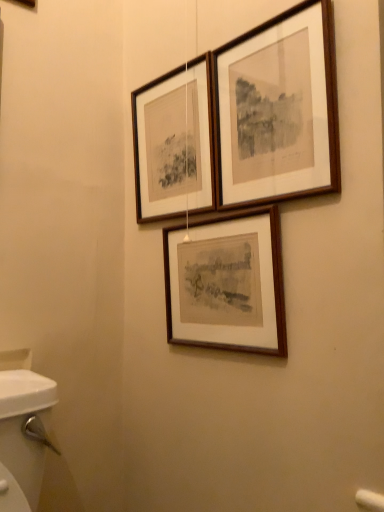
Where is `wooden picture frame at upper center, which is the 3th picture frame in bottom-to-top order`? The image size is (384, 512). wooden picture frame at upper center, which is the 3th picture frame in bottom-to-top order is located at coordinates click(278, 109).

What is the approximate height of wooden picture frame at upper center, which is the 3th picture frame in bottom-to-top order?

It is 15.46 inches.

How much space does wooden frame at upper center, which ranks as the second picture frame in top-to-bottom order, occupy horizontally?

wooden frame at upper center, which ranks as the second picture frame in top-to-bottom order, is 1.67 inches in width.

Where is `wooden frame at center, which is the third picture frame in top-to-bottom order`? This screenshot has width=384, height=512. wooden frame at center, which is the third picture frame in top-to-bottom order is located at coordinates (229, 283).

Which of these two, wooden frame at center, which is the third picture frame in top-to-bottom order, or wooden frame at upper center, which ranks as the second picture frame in top-to-bottom order, is wider?

With larger width is wooden frame at center, which is the third picture frame in top-to-bottom order.

How different are the orientations of wooden frame at center, which is the third picture frame in top-to-bottom order, and wooden frame at upper center, the 2th picture frame ordered from the bottom, in degrees?

The angle between the facing direction of wooden frame at center, which is the third picture frame in top-to-bottom order, and the facing direction of wooden frame at upper center, the 2th picture frame ordered from the bottom, is 2.11 degrees.

Is wooden frame at center, which is the third picture frame in top-to-bottom order, further to camera compared to wooden frame at upper center, which ranks as the second picture frame in top-to-bottom order?

That is False.

Considering the relative positions of wooden frame at center, which is the third picture frame in top-to-bottom order, and wooden frame at upper center, which ranks as the second picture frame in top-to-bottom order, in the image provided, is wooden frame at center, which is the third picture frame in top-to-bottom order, to the left or to the right of wooden frame at upper center, which ranks as the second picture frame in top-to-bottom order,?

Clearly, wooden frame at center, which is the third picture frame in top-to-bottom order, is on the right of wooden frame at upper center, which ranks as the second picture frame in top-to-bottom order, in the image.

How many degrees apart are the facing directions of wooden picture frame at upper center, the 1th picture frame when ordered from top to bottom, and wooden frame at center, positioned as the first picture frame in bottom-to-top order?

wooden picture frame at upper center, the 1th picture frame when ordered from top to bottom, and wooden frame at center, positioned as the first picture frame in bottom-to-top order, are facing 0.41 degrees away from each other.

Consider the image. Could you tell me if wooden picture frame at upper center, which is the 3th picture frame in bottom-to-top order, is turned towards wooden frame at center, which is the third picture frame in top-to-bottom order?

No.

Is wooden picture frame at upper center, the 1th picture frame when ordered from top to bottom, taller or shorter than wooden frame at center, positioned as the first picture frame in bottom-to-top order?

Considering their sizes, wooden picture frame at upper center, the 1th picture frame when ordered from top to bottom, has more height than wooden frame at center, positioned as the first picture frame in bottom-to-top order.

From the image's perspective, is wooden picture frame at upper center, the 1th picture frame when ordered from top to bottom, positioned above or below wooden frame at center, which is the third picture frame in top-to-bottom order?

From the image's perspective, wooden picture frame at upper center, the 1th picture frame when ordered from top to bottom, appears above wooden frame at center, which is the third picture frame in top-to-bottom order.

Does wooden picture frame at upper center, which is the 3th picture frame in bottom-to-top order, have a lesser height compared to wooden frame at upper center, the 2th picture frame ordered from the bottom?

Indeed, wooden picture frame at upper center, which is the 3th picture frame in bottom-to-top order, has a lesser height compared to wooden frame at upper center, the 2th picture frame ordered from the bottom.

Is point (296, 11) farther from camera compared to point (152, 164)?

No, (296, 11) is closer to viewer.

Choose the correct answer: Is wooden picture frame at upper center, the 1th picture frame when ordered from top to bottom, inside wooden frame at upper center, which ranks as the second picture frame in top-to-bottom order, or outside it?

wooden picture frame at upper center, the 1th picture frame when ordered from top to bottom, is not enclosed by wooden frame at upper center, which ranks as the second picture frame in top-to-bottom order.

Is the surface of wooden picture frame at upper center, which is the 3th picture frame in bottom-to-top order, in direct contact with wooden frame at upper center, which ranks as the second picture frame in top-to-bottom order?

No, wooden picture frame at upper center, which is the 3th picture frame in bottom-to-top order, is not in contact with wooden frame at upper center, which ranks as the second picture frame in top-to-bottom order.

Between point (212, 142) and point (194, 285), which one is positioned behind?

The point (194, 285) is farther from the camera.

Could wooden frame at center, which is the third picture frame in top-to-bottom order, be considered to be inside wooden frame at upper center, which ranks as the second picture frame in top-to-bottom order?

No, wooden frame at center, which is the third picture frame in top-to-bottom order, is not a part of wooden frame at upper center, which ranks as the second picture frame in top-to-bottom order.

From a real-world perspective, which object stands above the other?

From a 3D spatial view, wooden frame at upper center, the 2th picture frame ordered from the bottom, is above.

Who is more distant, wooden frame at upper center, the 2th picture frame ordered from the bottom, or wooden frame at center, positioned as the first picture frame in bottom-to-top order?

wooden frame at upper center, the 2th picture frame ordered from the bottom, is further from the camera.

Who is shorter, wooden frame at upper center, the 2th picture frame ordered from the bottom, or wooden picture frame at upper center, the 1th picture frame when ordered from top to bottom?

Standing shorter between the two is wooden picture frame at upper center, the 1th picture frame when ordered from top to bottom.

Between wooden frame at upper center, which ranks as the second picture frame in top-to-bottom order, and wooden picture frame at upper center, the 1th picture frame when ordered from top to bottom, which one appears on the left side from the viewer's perspective?

wooden frame at upper center, which ranks as the second picture frame in top-to-bottom order.

Could you tell me if wooden frame at upper center, which ranks as the second picture frame in top-to-bottom order, is turned towards wooden picture frame at upper center, which is the 3th picture frame in bottom-to-top order?

No, wooden frame at upper center, which ranks as the second picture frame in top-to-bottom order, does not turn towards wooden picture frame at upper center, which is the 3th picture frame in bottom-to-top order.

From the image's perspective, does wooden frame at upper center, the 2th picture frame ordered from the bottom, appear lower than wooden picture frame at upper center, which is the 3th picture frame in bottom-to-top order?

Yes, from the image's perspective, wooden frame at upper center, the 2th picture frame ordered from the bottom, is beneath wooden picture frame at upper center, which is the 3th picture frame in bottom-to-top order.

Does wooden frame at center, which is the third picture frame in top-to-bottom order, have a larger size compared to wooden picture frame at upper center, which is the 3th picture frame in bottom-to-top order?

Indeed, wooden frame at center, which is the third picture frame in top-to-bottom order, has a larger size compared to wooden picture frame at upper center, which is the 3th picture frame in bottom-to-top order.

From a real-world perspective, is wooden frame at center, positioned as the first picture frame in bottom-to-top order, below wooden picture frame at upper center, which is the 3th picture frame in bottom-to-top order?

Indeed, from a real-world perspective, wooden frame at center, positioned as the first picture frame in bottom-to-top order, is positioned beneath wooden picture frame at upper center, which is the 3th picture frame in bottom-to-top order.

Which object is closer to the camera taking this photo, wooden frame at center, positioned as the first picture frame in bottom-to-top order, or wooden picture frame at upper center, which is the 3th picture frame in bottom-to-top order?

wooden picture frame at upper center, which is the 3th picture frame in bottom-to-top order, is more forward.

How different are the orientations of wooden frame at center, which is the third picture frame in top-to-bottom order, and wooden picture frame at upper center, the 1th picture frame when ordered from top to bottom, in degrees?

The angular difference between wooden frame at center, which is the third picture frame in top-to-bottom order, and wooden picture frame at upper center, the 1th picture frame when ordered from top to bottom, is 0.41 degrees.

From the image's perspective, starting from the wooden frame at center, positioned as the first picture frame in bottom-to-top order, which picture frame is the 1st one above? Please provide its 2D coordinates.

[(174, 143)]

Find the location of `picture frame that is in front of the wooden frame at center, positioned as the first picture frame in bottom-to-top order`. picture frame that is in front of the wooden frame at center, positioned as the first picture frame in bottom-to-top order is located at coordinates (278, 109).

Looking at the image, which one is located closer to wooden frame at upper center, which ranks as the second picture frame in top-to-bottom order, wooden frame at center, positioned as the first picture frame in bottom-to-top order, or wooden picture frame at upper center, which is the 3th picture frame in bottom-to-top order?

wooden picture frame at upper center, which is the 3th picture frame in bottom-to-top order, is positioned closer to the anchor wooden frame at upper center, which ranks as the second picture frame in top-to-bottom order.

Considering their positions, is wooden frame at center, positioned as the first picture frame in bottom-to-top order, positioned further to wooden picture frame at upper center, the 1th picture frame when ordered from top to bottom, than wooden frame at upper center, the 2th picture frame ordered from the bottom?

Based on the image, wooden frame at center, positioned as the first picture frame in bottom-to-top order, appears to be further to wooden picture frame at upper center, the 1th picture frame when ordered from top to bottom.

Estimate the real-world distances between objects in this image. Which object is closer to wooden frame at upper center, which ranks as the second picture frame in top-to-bottom order, wooden picture frame at upper center, which is the 3th picture frame in bottom-to-top order, or wooden frame at center, positioned as the first picture frame in bottom-to-top order?

Based on the image, wooden picture frame at upper center, which is the 3th picture frame in bottom-to-top order, appears to be nearer to wooden frame at upper center, which ranks as the second picture frame in top-to-bottom order.

When comparing their distances from wooden picture frame at upper center, the 1th picture frame when ordered from top to bottom, does wooden frame at upper center, which ranks as the second picture frame in top-to-bottom order, or wooden frame at center, which is the third picture frame in top-to-bottom order, seem further?

Based on the image, wooden frame at center, which is the third picture frame in top-to-bottom order, appears to be further to wooden picture frame at upper center, the 1th picture frame when ordered from top to bottom.

Based on their spatial positions, is wooden frame at upper center, which ranks as the second picture frame in top-to-bottom order, or wooden picture frame at upper center, the 1th picture frame when ordered from top to bottom, further from wooden frame at center, which is the third picture frame in top-to-bottom order?

Among the two, wooden frame at upper center, which ranks as the second picture frame in top-to-bottom order, is located further to wooden frame at center, which is the third picture frame in top-to-bottom order.

From the image, which object appears to be farther from wooden frame at center, positioned as the first picture frame in bottom-to-top order, wooden picture frame at upper center, the 1th picture frame when ordered from top to bottom, or wooden frame at upper center, which ranks as the second picture frame in top-to-bottom order?

Among the two, wooden frame at upper center, which ranks as the second picture frame in top-to-bottom order, is located further to wooden frame at center, positioned as the first picture frame in bottom-to-top order.

The image size is (384, 512). Find the location of `picture frame between wooden picture frame at upper center, which is the 3th picture frame in bottom-to-top order, and wooden frame at center, positioned as the first picture frame in bottom-to-top order, from top to bottom`. picture frame between wooden picture frame at upper center, which is the 3th picture frame in bottom-to-top order, and wooden frame at center, positioned as the first picture frame in bottom-to-top order, from top to bottom is located at coordinates (174, 143).